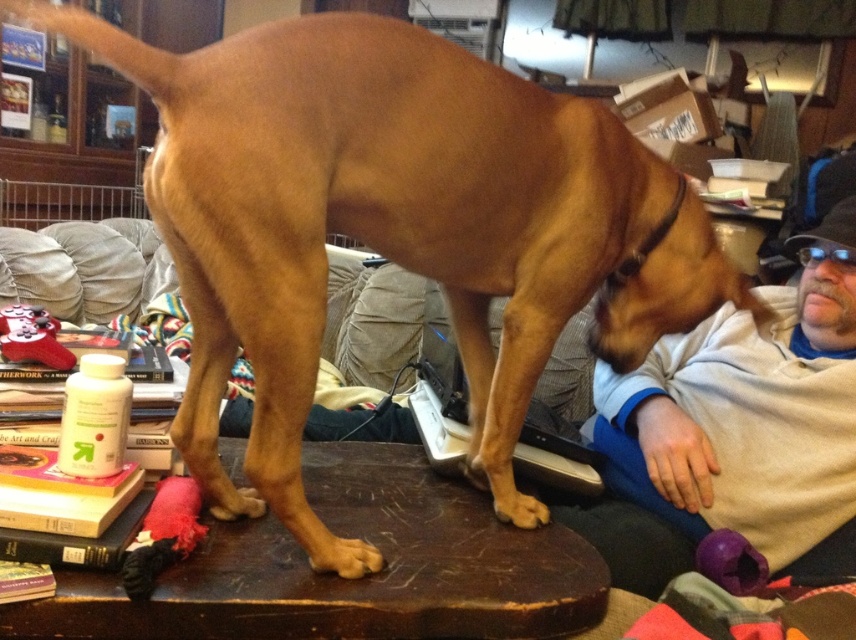
Consider the image. Which is below, brown wooden table at center or brown rough fur paw at lower center?

brown rough fur paw at lower center is lower down.

The image size is (856, 640). Describe the element at coordinates (348, 579) in the screenshot. I see `brown wooden table at center` at that location.

I want to click on brown wooden table at center, so click(x=348, y=579).

Is the position of brown rough fur paw at lower center more distant than that of golden fur paw at lower center?

No, it is in front of golden fur paw at lower center.

Who is positioned more to the right, brown rough fur paw at lower center or golden fur paw at lower center?

Positioned to the right is golden fur paw at lower center.

Measure the distance between point (x=336, y=548) and camera.

They are 34.52 inches apart.

The width and height of the screenshot is (856, 640). Identify the location of brown rough fur paw at lower center. (342, 556).

Is brown wooden table at center thinner than red plush stocking at upper left?

Incorrect, brown wooden table at center's width is not less than red plush stocking at upper left's.

Can you confirm if brown wooden table at center is shorter than red plush stocking at upper left?

In fact, brown wooden table at center may be taller than red plush stocking at upper left.

Who is more distant from viewer, (446, 589) or (10, 340)?

Positioned behind is point (10, 340).

Image resolution: width=856 pixels, height=640 pixels. I want to click on brown wooden table at center, so click(348, 579).